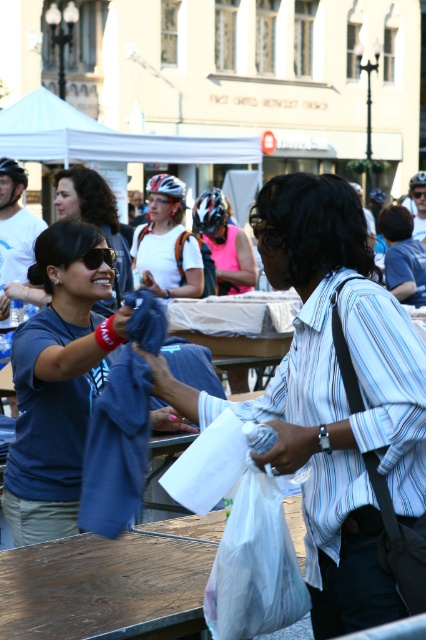
Does pink fabric at center come in front of black plastic sunglasses at upper left?

No.

What do you see at coordinates (224, 243) in the screenshot? The height and width of the screenshot is (640, 426). I see `pink fabric at center` at bounding box center [224, 243].

The width and height of the screenshot is (426, 640). Identify the location of pink fabric at center. (224, 243).

Between white matte helmet at center and pink fabric at center, which one has more height?

Standing taller between the two is white matte helmet at center.

Locate an element on the screen. Image resolution: width=426 pixels, height=640 pixels. white matte helmet at center is located at coordinates (166, 243).

Does point (71, 358) come behind point (164, 259)?

No.

Which is below, matte blue t-shirt at center or white matte helmet at center?

matte blue t-shirt at center is lower down.

At what (x,y) coordinates should I click in order to perform the action: click on matte blue t-shirt at center. Please return your answer as a coordinate pair (x, y). Image resolution: width=426 pixels, height=640 pixels. Looking at the image, I should click on (57, 384).

Locate an element on the screen. Image resolution: width=426 pixels, height=640 pixels. matte blue t-shirt at center is located at coordinates [x=57, y=384].